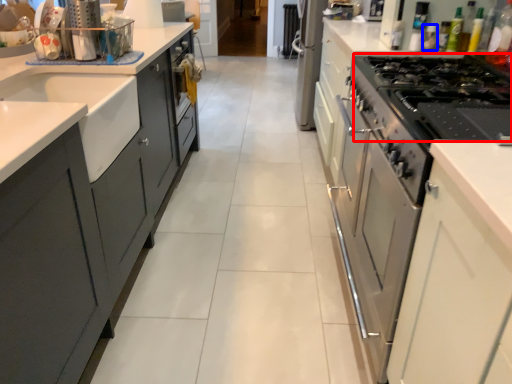
Question: Among these objects, which one is farthest to the camera, gas stove (highlighted by a red box) or bottle (highlighted by a blue box)?

Choices:
 (A) gas stove
 (B) bottle

Answer: (B)